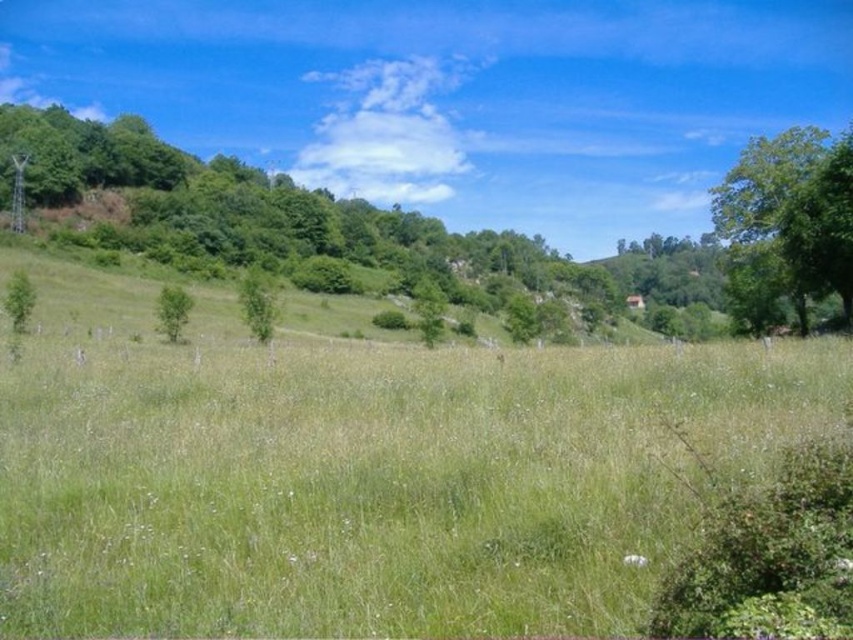
Is green leafy tree at right smaller than green leafy tree at center?

Actually, green leafy tree at right might be larger than green leafy tree at center.

Is green leafy tree at right above green leafy tree at center?

Correct, green leafy tree at right is located above green leafy tree at center.

This screenshot has width=853, height=640. What are the coordinates of `green leafy tree at right` in the screenshot? It's located at pos(787,225).

Locate an element on the screen. This screenshot has height=640, width=853. green leafy tree at right is located at coordinates click(x=787, y=225).